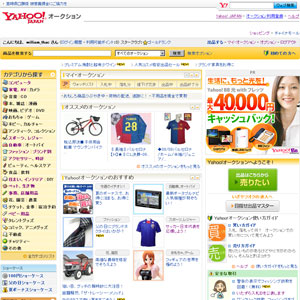
At what (x,y) coordinates should I click in order to perform the action: click on phone. Please return your answer as a coordinate pair (x, y). Looking at the image, I should click on (261, 137).